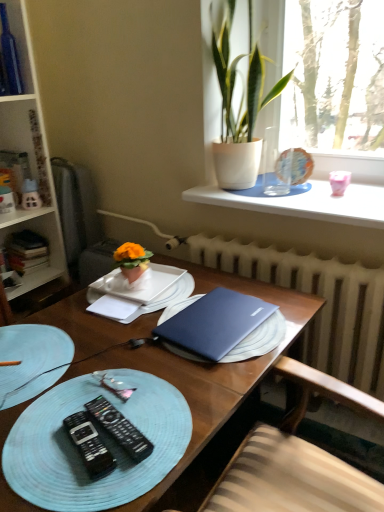
You are a GUI agent. You are given a task and a screenshot of the screen. Output one action in this format:
    pyautogui.click(x=<x>, y=<y>)
    Task: Click on the vacant space that is to the left of black plastic remote control at lower left, positioned as the 1th remote control in left-to-right order
    The width and height of the screenshot is (384, 512).
    Given the screenshot: What is the action you would take?
    pyautogui.click(x=33, y=441)